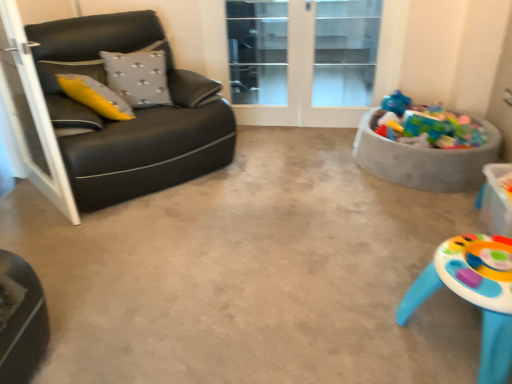
This screenshot has width=512, height=384. I want to click on vacant area that lies in front of black leather couch at left, so click(x=144, y=246).